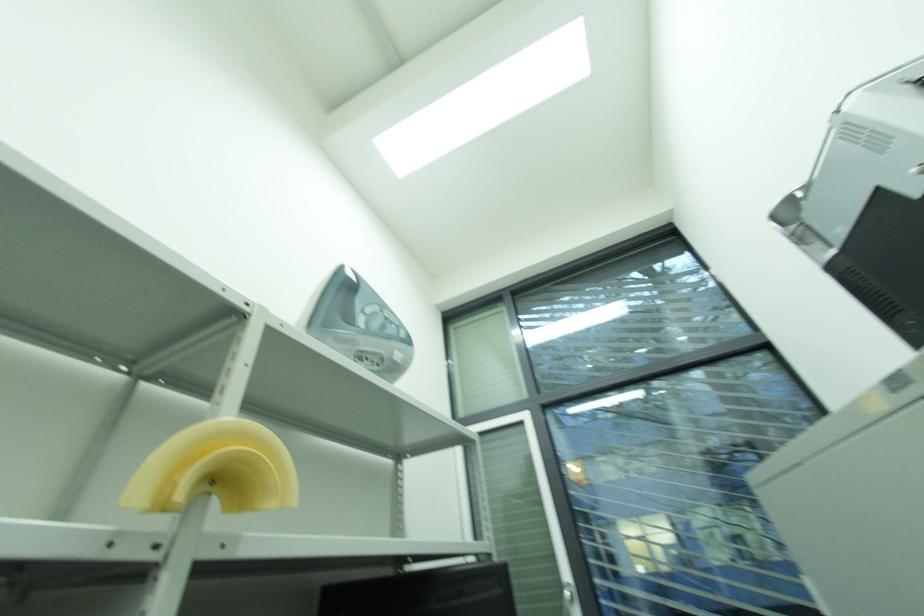
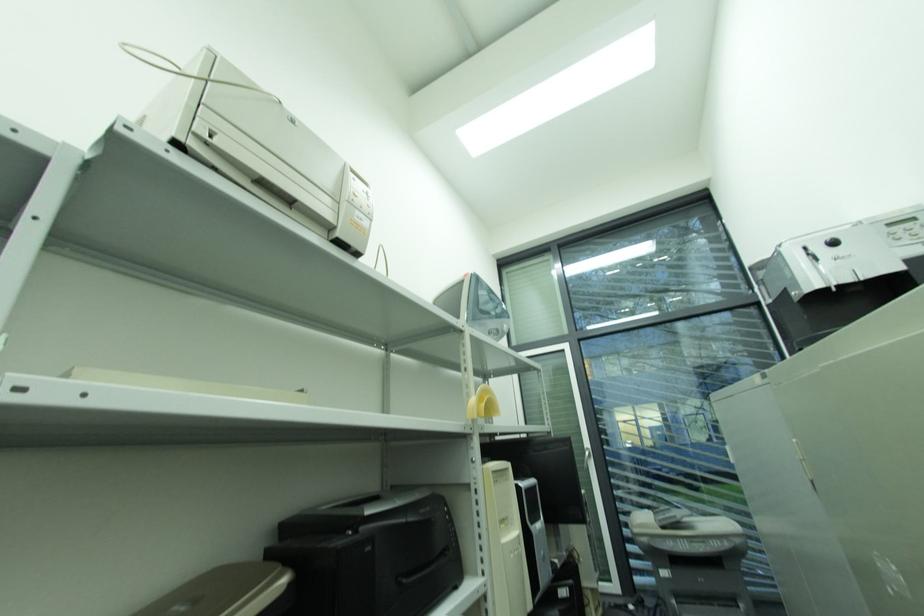
The images are taken continuously from a first-person perspective. In which direction are you moving?

The cameraman walked toward left, backward.